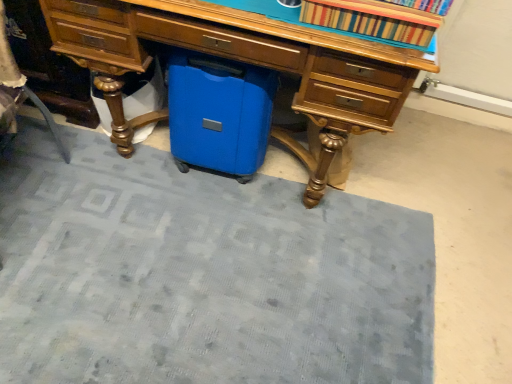
I want to click on blue plastic suitcase at center, so click(219, 113).

The image size is (512, 384). Find the location of `striped fabric book at upper center`. striped fabric book at upper center is located at coordinates (372, 19).

Where is `desk lying behind the striped fabric book at upper center`? desk lying behind the striped fabric book at upper center is located at coordinates (250, 62).

Who is taller, striped fabric book at upper center or matte wood desk at center?

matte wood desk at center.

From a real-world perspective, is striped fabric book at upper center above or below matte wood desk at center?

striped fabric book at upper center is above matte wood desk at center.

In the scene shown: How different are the orientations of striped fabric book at upper center and matte wood desk at center in degrees?

They differ by 2.69 degrees in their facing directions.

From the image's perspective, is matte wood desk at center on top of striped fabric book at upper center?

Actually, matte wood desk at center appears below striped fabric book at upper center in the image.

Based on the photo, in terms of size, does matte wood desk at center appear bigger or smaller than striped fabric book at upper center?

Considering their sizes, matte wood desk at center takes up more space than striped fabric book at upper center.

Between matte wood desk at center and striped fabric book at upper center, which one appears on the right side from the viewer's perspective?

Positioned to the right is striped fabric book at upper center.

From the image's perspective, which one is positioned lower, matte wood desk at center or blue fabric doormat at lower center?

blue fabric doormat at lower center appears lower in the image.

Which object is positioned more to the right, matte wood desk at center or blue fabric doormat at lower center?

matte wood desk at center is more to the right.

Locate an element on the screen. doormat that appears behind the matte wood desk at center is located at coordinates (202, 275).

Considering the positions of objects matte wood desk at center and blue fabric doormat at lower center in the image provided, who is in front, matte wood desk at center or blue fabric doormat at lower center?

Positioned in front is matte wood desk at center.

Can you confirm if blue plastic suitcase at center is bigger than striped fabric book at upper center?

Yes.

Between blue plastic suitcase at center and striped fabric book at upper center, which one appears on the right side from the viewer's perspective?

striped fabric book at upper center is more to the right.

Which is nearer, (x=249, y=91) or (x=416, y=20)?

Point (x=249, y=91) appears to be farther away from the viewer than point (x=416, y=20).

Based on their positions, is blue plastic suitcase at center located to the left or right of matte wood desk at center?

blue plastic suitcase at center is to the left of matte wood desk at center.

How much distance is there between blue plastic suitcase at center and matte wood desk at center?

A distance of 8.93 inches exists between blue plastic suitcase at center and matte wood desk at center.

Where is `desk in front of the blue plastic suitcase at center`? The image size is (512, 384). desk in front of the blue plastic suitcase at center is located at coordinates (250, 62).

Measure the distance between blue fabric doormat at lower center and matte wood desk at center.

blue fabric doormat at lower center and matte wood desk at center are 17.72 inches apart.

From the picture: From the image's perspective, which one is positioned higher, blue fabric doormat at lower center or matte wood desk at center?

matte wood desk at center, from the image's perspective.

Can we say blue fabric doormat at lower center lies outside matte wood desk at center?

Indeed, blue fabric doormat at lower center is completely outside matte wood desk at center.

In the scene shown: Which is nearer, (125, 376) or (394, 74)?

Point (125, 376) appears to be farther away from the viewer than point (394, 74).

Where is `book above the blue plastic suitcase at center (from the image's perspective)`? The width and height of the screenshot is (512, 384). book above the blue plastic suitcase at center (from the image's perspective) is located at coordinates (372, 19).

Considering the relative positions of striped fabric book at upper center and blue plastic suitcase at center in the image provided, is striped fabric book at upper center to the left or to the right of blue plastic suitcase at center?

Clearly, striped fabric book at upper center is on the right of blue plastic suitcase at center in the image.

Between striped fabric book at upper center and blue plastic suitcase at center, which one is positioned in front?

striped fabric book at upper center.

Locate an element on the screen. This screenshot has height=384, width=512. desk that is under the striped fabric book at upper center (from a real-world perspective) is located at coordinates (250, 62).

Find the location of a particular element. This screenshot has width=512, height=384. book on the right side of matte wood desk at center is located at coordinates (372, 19).

Looking at the image, which one is located closer to striped fabric book at upper center, blue plastic suitcase at center or blue fabric doormat at lower center?

blue plastic suitcase at center.

Looking at the image, which one is located closer to blue fabric doormat at lower center, matte wood desk at center or striped fabric book at upper center?

matte wood desk at center.

Considering their positions, is matte wood desk at center positioned further to blue fabric doormat at lower center than blue plastic suitcase at center?

Based on the image, matte wood desk at center appears to be further to blue fabric doormat at lower center.

Looking at the image, which one is located closer to matte wood desk at center, blue plastic suitcase at center or striped fabric book at upper center?

blue plastic suitcase at center is closer to matte wood desk at center.

Estimate the real-world distances between objects in this image. Which object is further from matte wood desk at center, striped fabric book at upper center or blue fabric doormat at lower center?

→ blue fabric doormat at lower center lies further to matte wood desk at center than the other object.

Based on their spatial positions, is blue fabric doormat at lower center or matte wood desk at center closer to striped fabric book at upper center?

matte wood desk at center is positioned closer to the anchor striped fabric book at upper center.

Which object lies nearer to the anchor point blue fabric doormat at lower center, striped fabric book at upper center or blue plastic suitcase at center?

Among the two, blue plastic suitcase at center is located nearer to blue fabric doormat at lower center.

Based on their spatial positions, is blue plastic suitcase at center or blue fabric doormat at lower center further from matte wood desk at center?

The object further to matte wood desk at center is blue fabric doormat at lower center.

The image size is (512, 384). I want to click on cooler between matte wood desk at center and blue fabric doormat at lower center in the up-down direction, so point(219,113).

Where is `desk between blue plastic suitcase at center and striped fabric book at upper center`? The width and height of the screenshot is (512, 384). desk between blue plastic suitcase at center and striped fabric book at upper center is located at coordinates (250, 62).

This screenshot has width=512, height=384. I want to click on cooler between striped fabric book at upper center and blue fabric doormat at lower center in the up-down direction, so tap(219, 113).

The height and width of the screenshot is (384, 512). I want to click on desk between striped fabric book at upper center and blue fabric doormat at lower center vertically, so click(x=250, y=62).